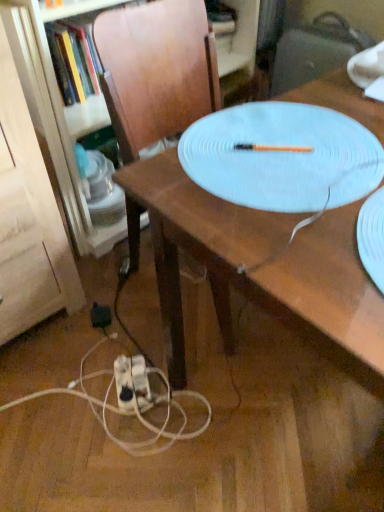
Locate an element on the screen. The image size is (384, 512). vacant space underneath white textured platter at center (from a real-world perspective) is located at coordinates (288, 164).